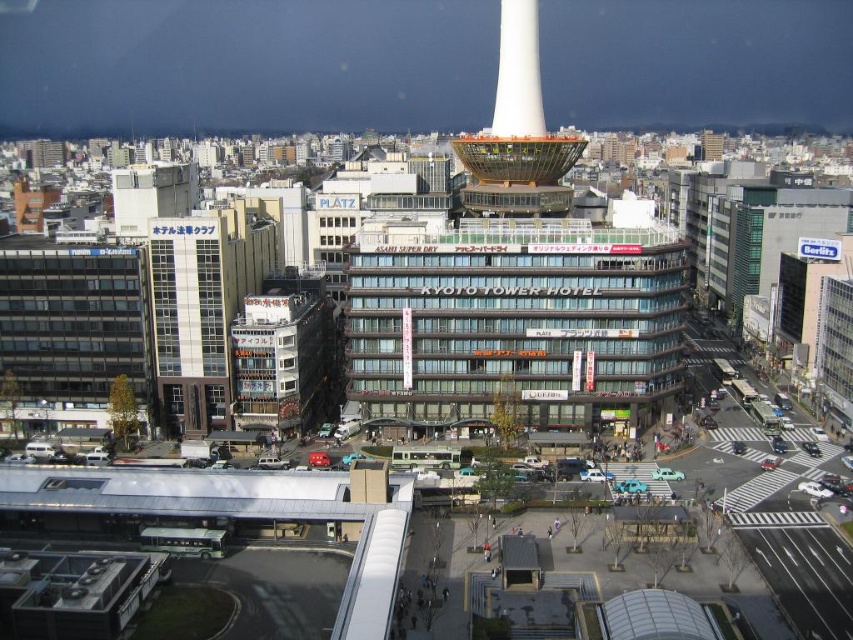
Question: Can you confirm if white glass building at left is smaller than white glossy tower at center?

Choices:
 (A) no
 (B) yes

Answer: (B)

Question: Considering the relative positions of white glass building at left and white glossy tower at center in the image provided, where is white glass building at left located with respect to white glossy tower at center?

Choices:
 (A) left
 (B) right

Answer: (A)

Question: Among these objects, which one is farthest from the camera?

Choices:
 (A) white glass building at left
 (B) white glossy tower at center

Answer: (B)

Question: Is white glass building at left below white glossy tower at center?

Choices:
 (A) no
 (B) yes

Answer: (B)

Question: Among these points, which one is nearest to the camera?

Choices:
 (A) (534, 211)
 (B) (192, 342)

Answer: (B)